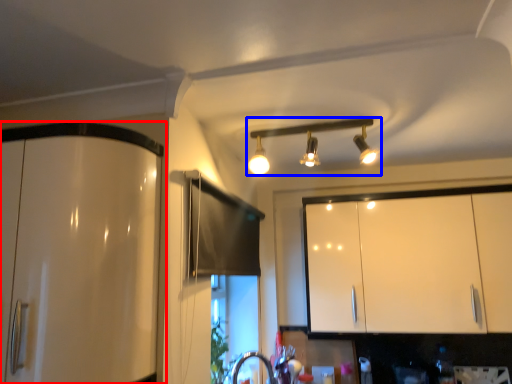
Question: Which object appears closest to the camera in this image, cabinetry (highlighted by a red box) or lamp (highlighted by a blue box)?

Choices:
 (A) cabinetry
 (B) lamp

Answer: (A)